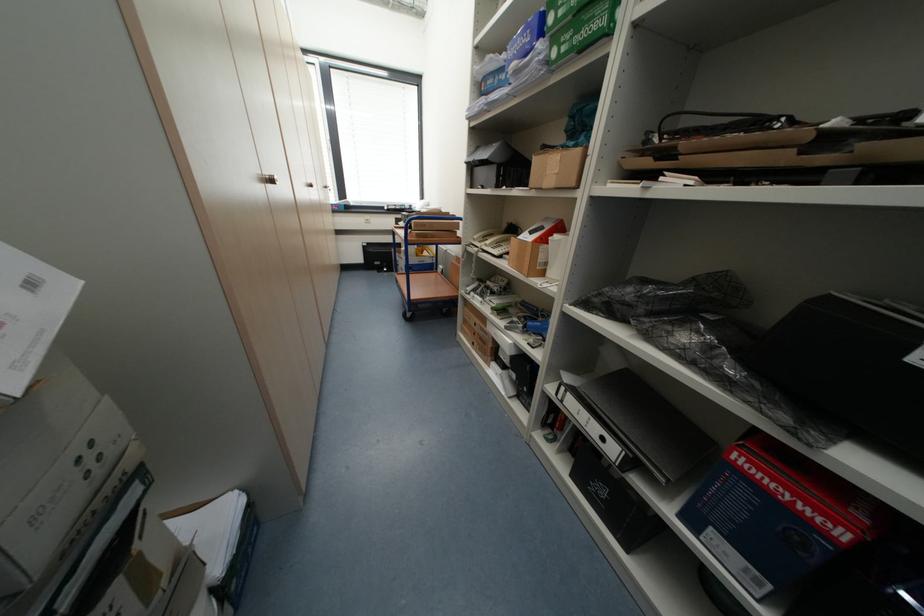
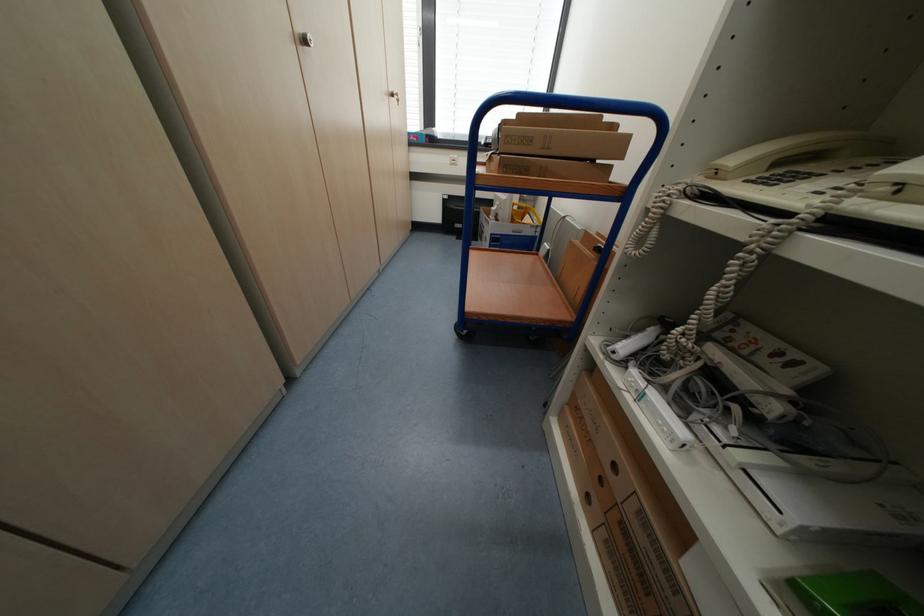
The point at (513, 282) is marked in the first image. Where is the corresponding point in the second image?

(823, 370)